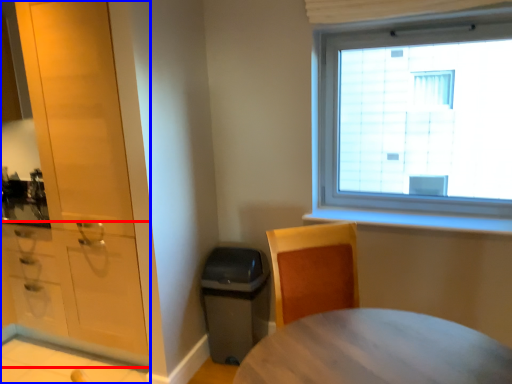
Question: Which of the following is the farthest to the observer, cabinetry (highlighted by a red box) or cabinetry (highlighted by a blue box)?

Choices:
 (A) cabinetry
 (B) cabinetry

Answer: (A)